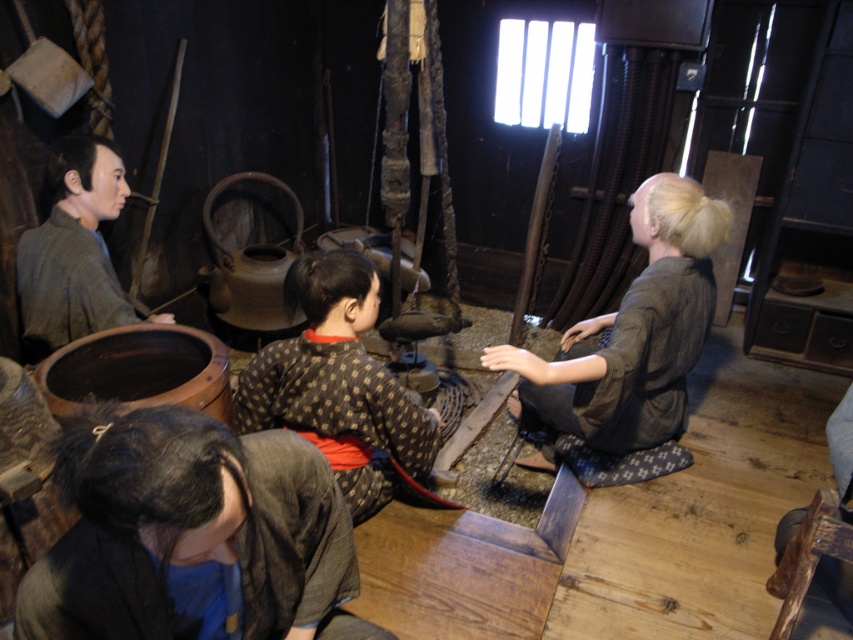
Looking at this image, can you confirm if dark gray kimono at lower left is thinner than matte green fabric at right?

Correct, dark gray kimono at lower left's width is less than matte green fabric at right's.

In order to click on dark gray kimono at lower left in this screenshot , I will do `click(194, 536)`.

Locate an element on the screen. The image size is (853, 640). dark gray kimono at lower left is located at coordinates (194, 536).

Does matte green fabric at right appear under brown textured kimono at center?

Yes.

You are a GUI agent. You are given a task and a screenshot of the screen. Output one action in this format:
    pyautogui.click(x=<x>, y=<y>)
    Task: Click on the matte green fabric at right
    
    Given the screenshot: What is the action you would take?
    pyautogui.click(x=630, y=336)

You are a GUI agent. You are given a task and a screenshot of the screen. Output one action in this format:
    pyautogui.click(x=<x>, y=<y>)
    Task: Click on the matte green fabric at right
    The image size is (853, 640).
    Given the screenshot: What is the action you would take?
    coord(630,336)

Does dark gray kimono at lower left have a smaller size compared to brown textured kimono at center?

Indeed, dark gray kimono at lower left has a smaller size compared to brown textured kimono at center.

Who is more distant from viewer, (35, 604) or (386, 400)?

Point (386, 400)

Find the location of a particular element. This screenshot has width=853, height=640. dark gray kimono at lower left is located at coordinates (194, 536).